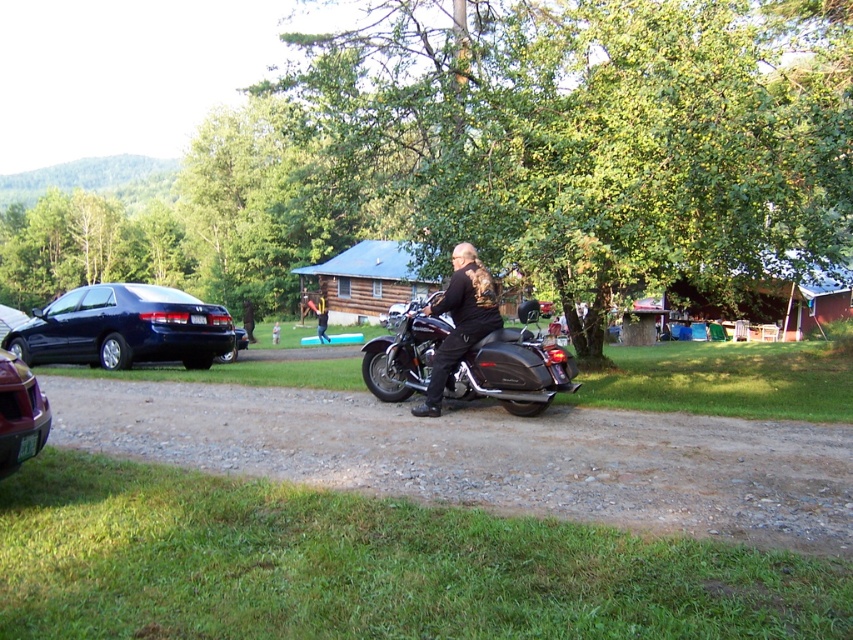
Question: Which point is farther to the camera?

Choices:
 (A) (447, 323)
 (B) (10, 378)
 (C) (22, 314)
 (D) (218, 312)

Answer: (C)

Question: Is black leather jacket at center wider than metallic maroon sedan at lower left?

Choices:
 (A) yes
 (B) no

Answer: (A)

Question: Which object is the closest to the black matte motorcycle at center?

Choices:
 (A) shiny blue sedan at left
 (B) metallic maroon sedan at lower left
 (C) black leather jacket at center

Answer: (C)

Question: Does black matte motorcycle at center have a larger size compared to black leather jacket at center?

Choices:
 (A) yes
 (B) no

Answer: (A)

Question: Can you confirm if black matte motorcycle at center is positioned above metallic maroon sedan at lower left?

Choices:
 (A) no
 (B) yes

Answer: (B)

Question: Which of the following is the closest to the observer?

Choices:
 (A) shiny blue sedan at left
 (B) black matte motorcycle at center
 (C) metallic maroon sedan at lower left
 (D) glossy blue sedan at left

Answer: (C)